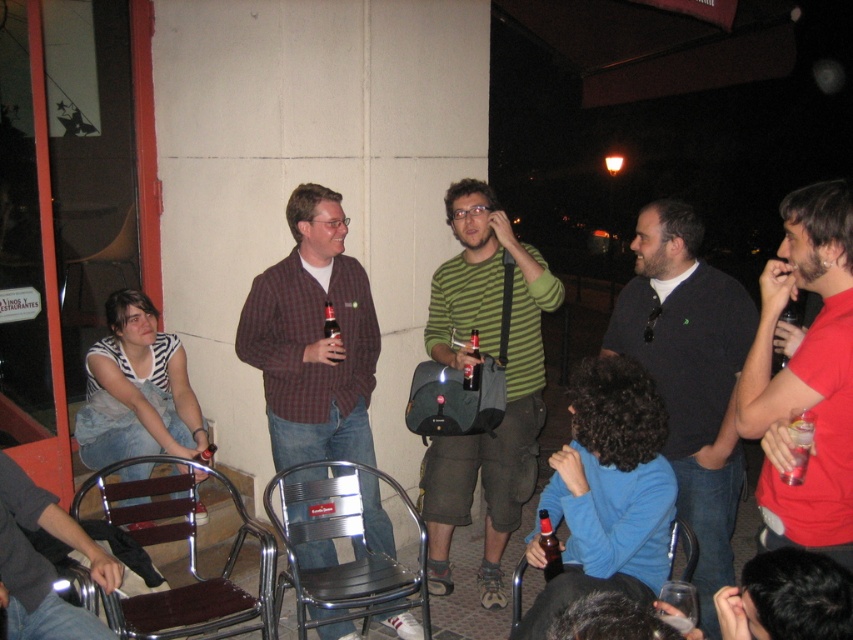
Question: Can you confirm if dark gray sweater at center is thinner than metallic brown chair at lower left?

Choices:
 (A) yes
 (B) no

Answer: (A)

Question: Does red shirt at right have a larger size compared to dark brown glass bottle at center?

Choices:
 (A) no
 (B) yes

Answer: (B)

Question: Which of the following is the farthest from the observer?

Choices:
 (A) [438, 336]
 (B) [161, 504]
 (C) [339, 324]

Answer: (A)

Question: Is dark brown glass bottle at center below matte glass bottle at center?

Choices:
 (A) no
 (B) yes

Answer: (B)

Question: Which point appears closest to the camera in this image?

Choices:
 (A) (78, 308)
 (B) (643, 208)

Answer: (B)

Question: Which of the following is the closest to the observer?

Choices:
 (A) metallic brown chair at lower left
 (B) matte glass bottle at center
 (C) metallic silver chair at left
 (D) plaid fabric shirt at center

Answer: (A)